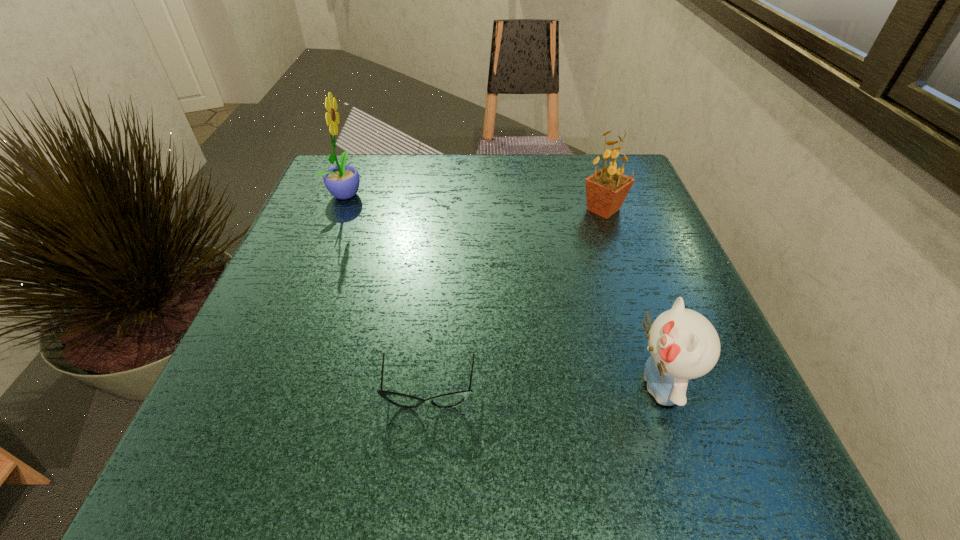
Where is `vacant space located 0.370m on the front-facing side of the kitten`? Image resolution: width=960 pixels, height=540 pixels. vacant space located 0.370m on the front-facing side of the kitten is located at coordinates (379, 386).

Identify the location of vacant space positioned on the front-facing side of the kitten. (468, 386).

Locate an element on the screen. The image size is (960, 540). vacant space located on the front-facing side of the kitten is located at coordinates (447, 386).

Find the location of a particular element. The height and width of the screenshot is (540, 960). object that is positioned at the left edge is located at coordinates (342, 181).

Locate an element on the screen. sunflower that is at the right edge is located at coordinates (606, 190).

The width and height of the screenshot is (960, 540). I want to click on kitten that is at the right edge, so click(x=683, y=344).

You are a GUI agent. You are given a task and a screenshot of the screen. Output one action in this format:
    pyautogui.click(x=<x>, y=<y>)
    Task: Click on the object at the far left corner
    This screenshot has width=960, height=540.
    Given the screenshot: What is the action you would take?
    pyautogui.click(x=342, y=181)

The image size is (960, 540). In order to click on object at the far right corner in this screenshot , I will do `click(606, 190)`.

This screenshot has width=960, height=540. In order to click on vacant region at the far edge of the desktop in this screenshot , I will do tap(442, 191).

I want to click on vacant area at the near edge, so click(x=403, y=444).